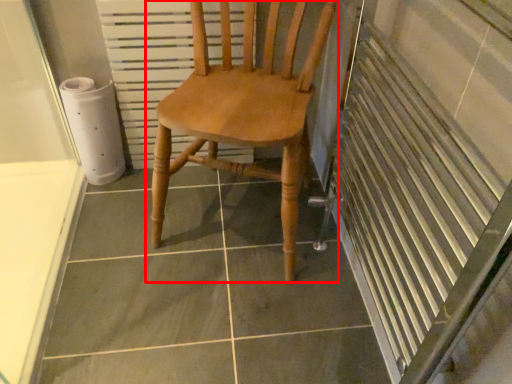
Question: In this image, where is chair (annotated by the red box) located relative to radiator?

Choices:
 (A) right
 (B) left

Answer: (A)